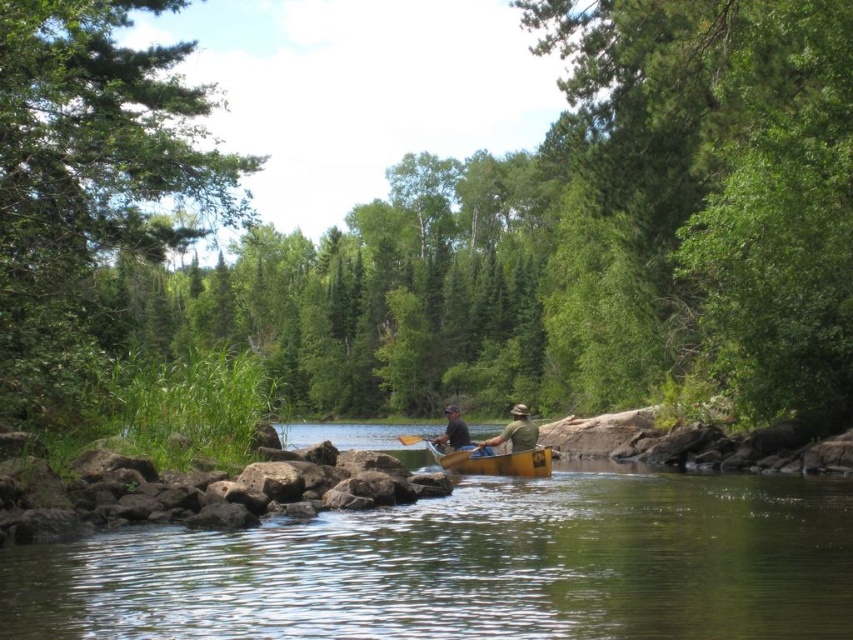
You are a photographer trying to capture the scene of the green fabric hat at center and the wooden paddle at center. Which object should you focus on if you want to photograph the taller one?

The wooden paddle at center is taller than the green fabric hat at center, so you should focus on the wooden paddle at center to photograph the taller one.

You are standing on the riverbank and see the green leafy tree at left and the wooden paddle at center in the canoe. Which object is higher from the ground?

The green leafy tree at left is located above the wooden paddle at center, so the green leafy tree at left is higher from the ground.

You are navigating a yellow canoe in a calm river surrounded by lush greenery. You notice two points marked on your map at coordinates point (71, 12) and point (444, 438). If you are facing downstream, which point should you aim for first to stay on the correct path?

Point (71, 12) is in front of point (444, 438), so you should aim for point (71, 12) first to stay on the correct path.